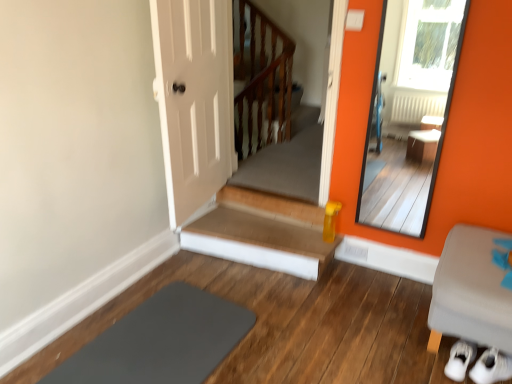
Question: Are gray fabric ottoman at lower right and smooth orange mirror at right located far from each other?

Choices:
 (A) no
 (B) yes

Answer: (B)

Question: Does gray fabric ottoman at lower right come in front of smooth orange mirror at right?

Choices:
 (A) yes
 (B) no

Answer: (A)

Question: Can you confirm if gray fabric ottoman at lower right is shorter than smooth orange mirror at right?

Choices:
 (A) yes
 (B) no

Answer: (A)

Question: From the image's perspective, is gray fabric ottoman at lower right over smooth orange mirror at right?

Choices:
 (A) yes
 (B) no

Answer: (B)

Question: From a real-world perspective, is gray fabric ottoman at lower right below smooth orange mirror at right?

Choices:
 (A) no
 (B) yes

Answer: (B)

Question: Considering the relative sizes of gray fabric ottoman at lower right and smooth orange mirror at right in the image provided, is gray fabric ottoman at lower right taller than smooth orange mirror at right?

Choices:
 (A) no
 (B) yes

Answer: (A)

Question: Does wooden stairs at center appear on the left side of smooth orange mirror at right?

Choices:
 (A) no
 (B) yes

Answer: (B)

Question: Is there a large distance between wooden stairs at center and smooth orange mirror at right?

Choices:
 (A) no
 (B) yes

Answer: (B)

Question: Is wooden stairs at center directly adjacent to smooth orange mirror at right?

Choices:
 (A) no
 (B) yes

Answer: (A)

Question: Is wooden stairs at center smaller than smooth orange mirror at right?

Choices:
 (A) yes
 (B) no

Answer: (B)

Question: Is smooth orange mirror at right surrounded by wooden stairs at center?

Choices:
 (A) no
 (B) yes

Answer: (A)

Question: From a real-world perspective, is wooden stairs at center physically above smooth orange mirror at right?

Choices:
 (A) yes
 (B) no

Answer: (B)

Question: From a real-world perspective, is wooden stairs at center positioned over slate at lower left based on gravity?

Choices:
 (A) no
 (B) yes

Answer: (B)